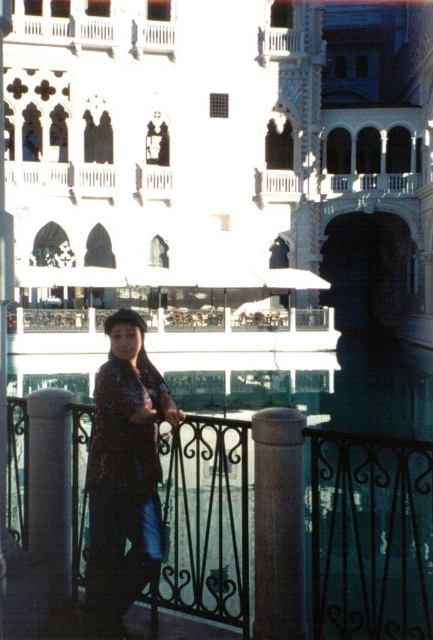
What do you see at coordinates (368, 536) in the screenshot?
I see `metallic wrought iron at center` at bounding box center [368, 536].

Which is in front, point (409, 472) or point (107, 42)?

Point (409, 472)

You are a GUI agent. You are given a task and a screenshot of the screen. Output one action in this format:
    pyautogui.click(x=<x>, y=<y>)
    Task: Click on the metallic wrought iron at center
    
    Given the screenshot: What is the action you would take?
    [368, 536]

Between metallic wrought iron at center and white glossy pillar at left, which one is positioned lower?

Positioned lower is metallic wrought iron at center.

Find the location of a particular element. metallic wrought iron at center is located at coordinates (368, 536).

I want to click on metallic wrought iron at center, so click(368, 536).

Does shiny purple blouse at center have a greater height compared to white wooden balcony at upper center?

Indeed, shiny purple blouse at center has a greater height compared to white wooden balcony at upper center.

Can you confirm if shiny purple blouse at center is positioned to the right of white wooden balcony at upper center?

Indeed, shiny purple blouse at center is positioned on the right side of white wooden balcony at upper center.

What do you see at coordinates (123, 474) in the screenshot?
I see `shiny purple blouse at center` at bounding box center [123, 474].

Where is `shiny purple blouse at center`? shiny purple blouse at center is located at coordinates (123, 474).